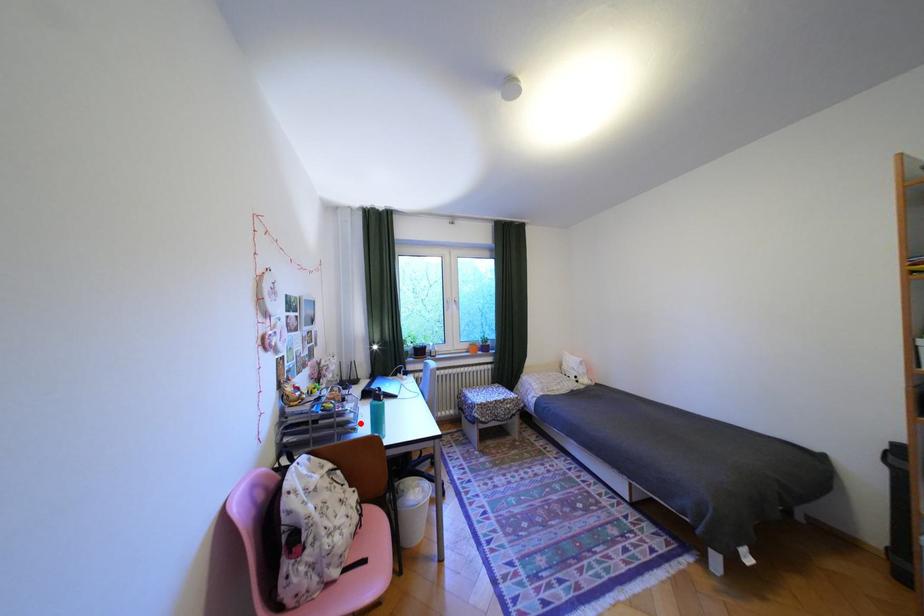
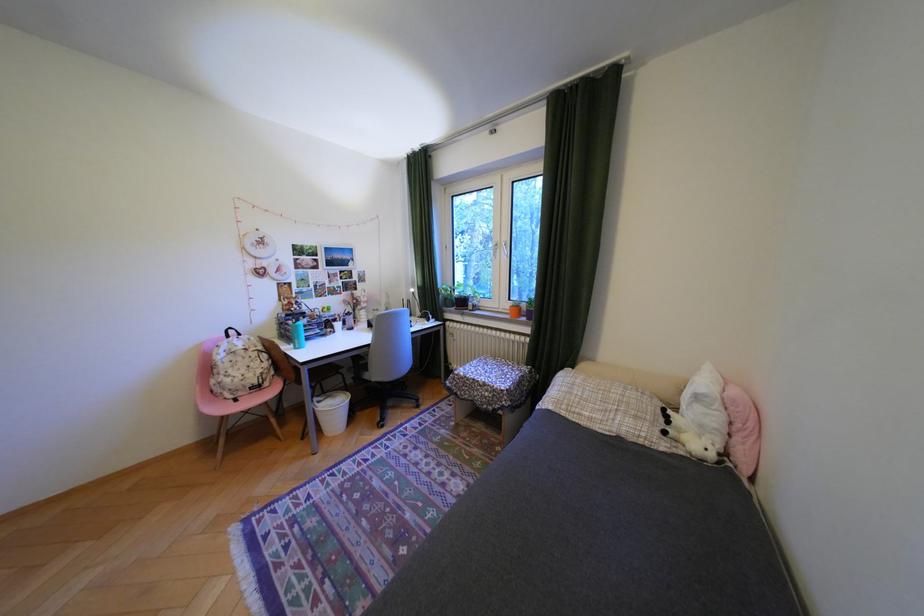
Question: I am providing you with two images of the same scene from different viewpoints. Image1 has a red point marked. In image2, the corresponding 3D location appears at what relative position? Reply with the corresponding letter.

Choices:
 (A) Closer
 (B) Farther

Answer: (A)